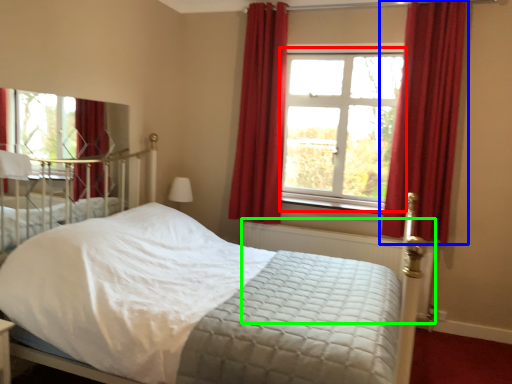
Question: Considering the real-world distances, which object is closest to window (highlighted by a red box)? curtain (highlighted by a blue box) or balustrade (highlighted by a green box).

Choices:
 (A) curtain
 (B) balustrade

Answer: (A)